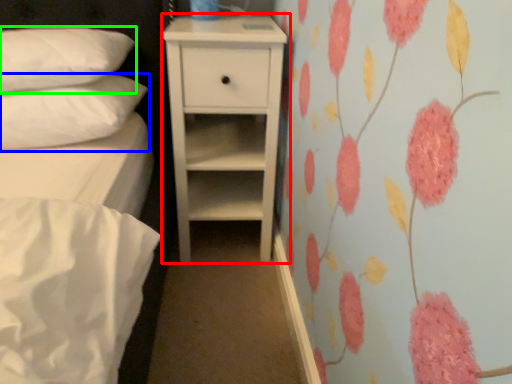
Question: Based on their relative distances, which object is farther from chest of drawers (highlighted by a red box)? Choose from pillow (highlighted by a blue box) and pillow (highlighted by a green box).

Choices:
 (A) pillow
 (B) pillow

Answer: (B)